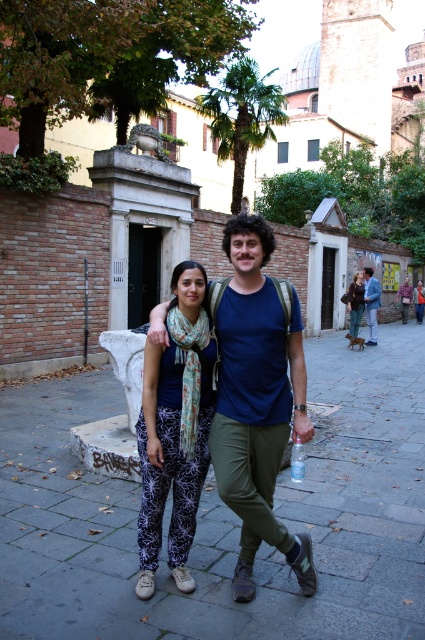
You are a photographer trying to capture a shot of the two people in the scene. You notice the leather jacket at center and the transparent plastic bottle at center. Which object is closer to the right edge of the photo?

The leather jacket at center is positioned on the right side of transparent plastic bottle at center, so the leather jacket at center is closer to the right edge of the photo.

You are a photographer setting up a tripod in the middle of the scene. The gray concrete pavement at center and the matte blue shirt at center are both in your view. Which object takes up more space in your camera frame?

The gray concrete pavement at center takes up more space in the camera frame because it is bigger than the matte blue shirt at center according to the description.